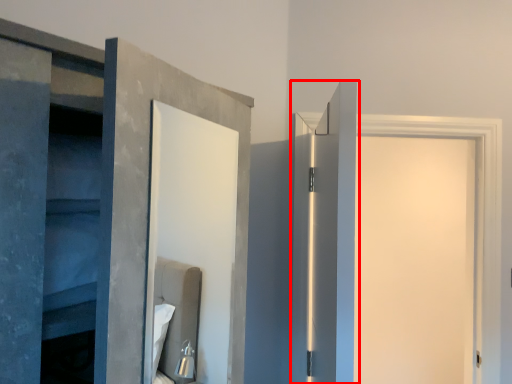
Question: From the image's perspective, where is door (annotated by the red box) located in relation to door in the image?

Choices:
 (A) above
 (B) below

Answer: (A)